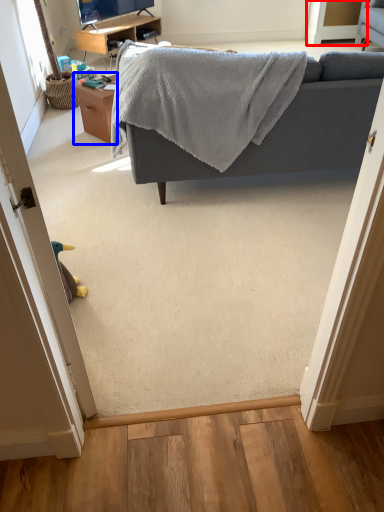
Question: Which point is closer to the camera, screen door (highlighted by a red box) or table (highlighted by a blue box)?

Choices:
 (A) screen door
 (B) table

Answer: (B)